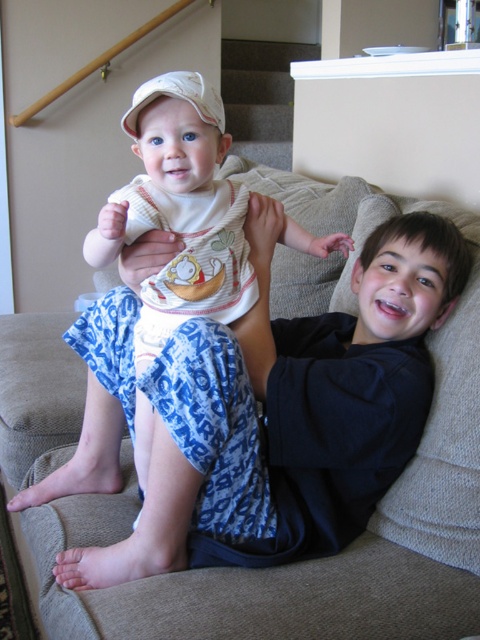
You are a tailor who needs to determine which clothing item requires more fabric between the blue cotton pajama pants at center and the white cotton onesie at center. Based on their sizes, which one would need more fabric?

The blue cotton pajama pants at center has a larger size compared to the white cotton onesie at center, so it would require more fabric.

You are an interior designer planning to place a decorative item on the couch where the blue cotton pajama pants at center are currently positioned. Based on the coordinates provided, can you confirm if there is enough space to place a small vase there?

The blue cotton pajama pants at center are located at point (294, 401), so there should be sufficient space to place a small vase as the coordinates indicate an area on the couch that isn not occupied by other objects.

Looking at this image, you are a photographer trying to capture a closeup of the blue cotton pajama pants at center and the white cotton onesie at center. Since you can only focus on one object at a time, which one should you choose if you want to focus on the one that is further to the right?

The blue cotton pajama pants at center is to the right of white cotton onesie at center, so you should focus on the blue cotton pajama pants at center to capture the one further to the right.